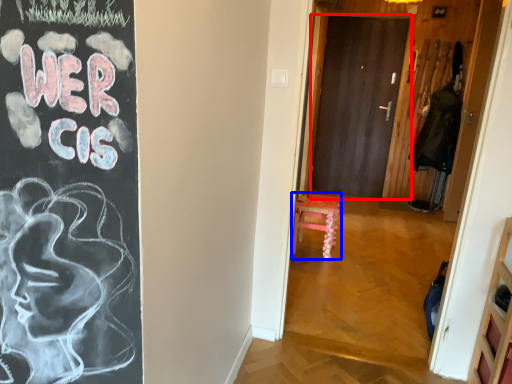
Question: Among these objects, which one is farthest to the camera, door (highlighted by a red box) or furniture (highlighted by a blue box)?

Choices:
 (A) door
 (B) furniture

Answer: (A)